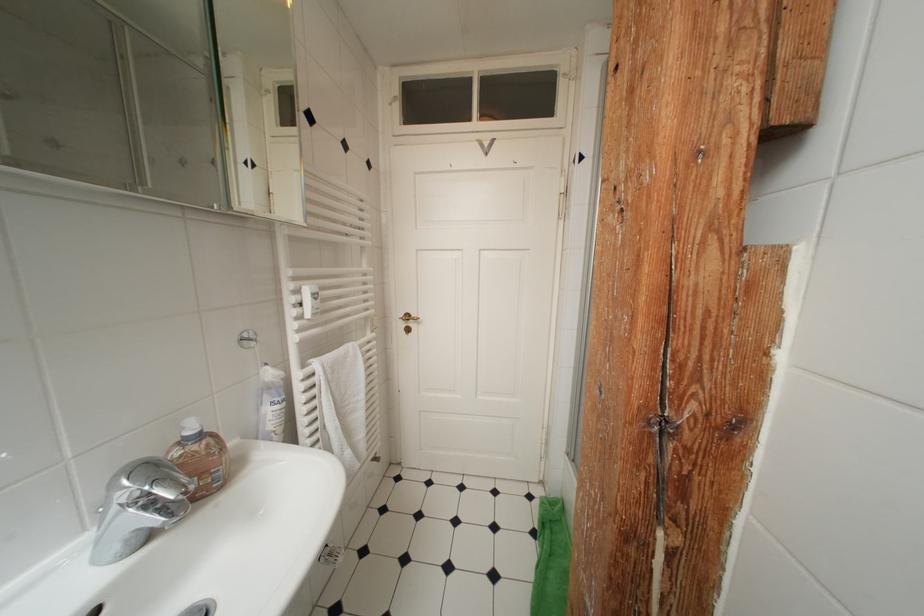
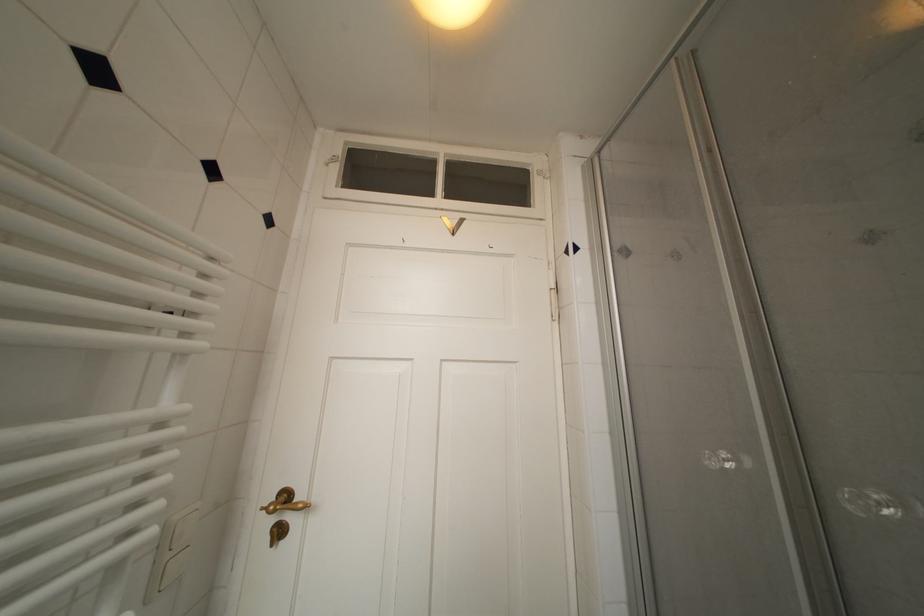
Question: Based on the continuous images, in which direction is the camera rotating? Reply with the corresponding letter.

Choices:
 (A) Left
 (B) Right
 (C) Up
 (D) Down

Answer: (C)